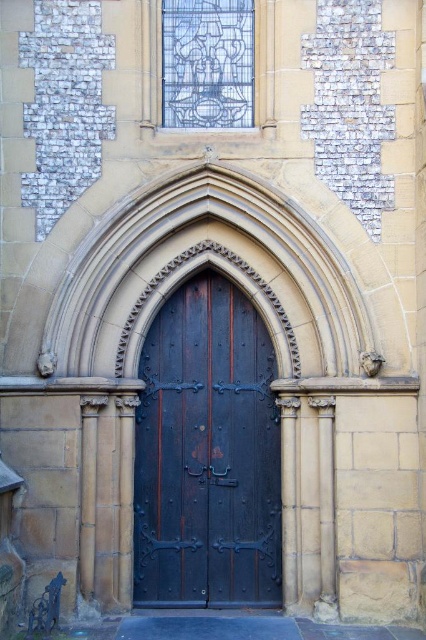
You are standing in front of the building shown in the image. The dark wood door at center is located at coordinates point 0.711, 0.486. If you want to approach the door, which direction should you move relative to your current position?

The dark wood door at center is located at point (207, 454), so you should move towards the center of the building to reach it.

You are an architect assessing the building facade. The dark wood door at center and the blue stained glass at upper center are both part of the design. Which object has a smaller size?

The dark wood door at center has a smaller size compared to the blue stained glass at upper center.

You are a painter who needs to place a ladder against the building to reach both the dark wood door at center and the blue stained glass at upper center. The ladder you have is 6 meters long. Will the ladder be long enough to reach both objects?

The dark wood door at center and the blue stained glass at upper center are 5.77 meters apart from each other. Since the ladder is 6 meters long, it will be long enough to reach both objects as the distance between them is less than the ladder length.